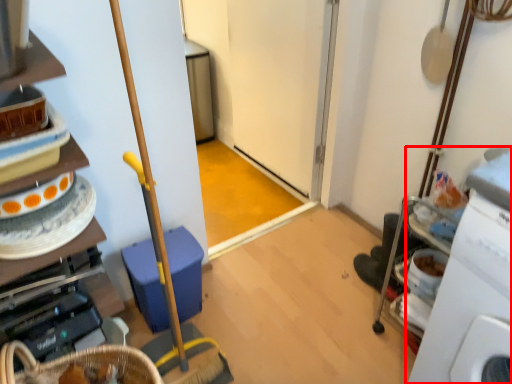
Question: Where is machine (annotated by the red box) located in relation to cabinetry in the image?

Choices:
 (A) right
 (B) left

Answer: (A)